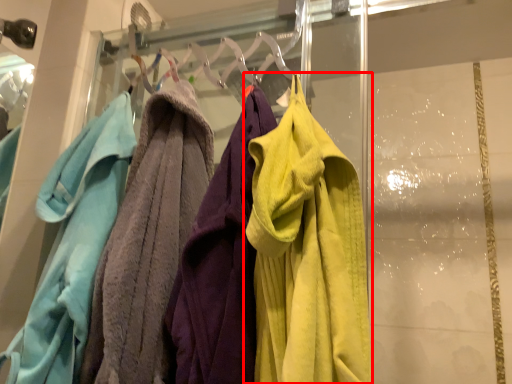
Question: From the image, what is the correct spatial relationship of towel (annotated by the red box) in relation to towel?

Choices:
 (A) left
 (B) right

Answer: (B)